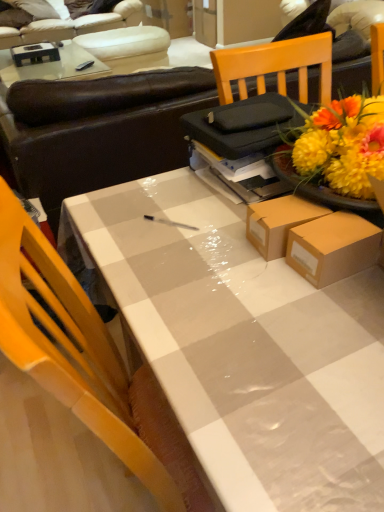
Question: Are white leather armchair at upper left and brown leather couch at upper center, which ranks as the first studio couch in front-to-back order, located far from each other?

Choices:
 (A) yes
 (B) no

Answer: (A)

Question: From the image's perspective, would you say white leather armchair at upper left is positioned over brown leather couch at upper center, arranged as the first studio couch when ordered from the bottom?

Choices:
 (A) no
 (B) yes

Answer: (B)

Question: From a real-world perspective, is white leather armchair at upper left beneath brown leather couch at upper center, arranged as the first studio couch when ordered from the bottom?

Choices:
 (A) yes
 (B) no

Answer: (A)

Question: Can you confirm if white leather armchair at upper left is taller than brown leather couch at upper center, the second studio couch when ordered from back to front?

Choices:
 (A) no
 (B) yes

Answer: (A)

Question: Is the depth of white leather armchair at upper left greater than that of brown leather couch at upper center, arranged as the first studio couch when ordered from the bottom?

Choices:
 (A) yes
 (B) no

Answer: (A)

Question: Is white leather armchair at upper left outside of brown leather couch at upper center, the second studio couch viewed from the top?

Choices:
 (A) no
 (B) yes

Answer: (B)

Question: Is white leather couch at upper left, which ranks as the first studio couch in top-to-bottom order, in front of brown leather couch at upper center, arranged as the first studio couch when ordered from the bottom?

Choices:
 (A) no
 (B) yes

Answer: (A)

Question: Can you confirm if white leather couch at upper left, the second studio couch positioned from the bottom, is thinner than brown leather couch at upper center, the second studio couch when ordered from back to front?

Choices:
 (A) no
 (B) yes

Answer: (A)

Question: Is the depth of white leather couch at upper left, which ranks as the first studio couch in top-to-bottom order, greater than that of brown leather couch at upper center, the second studio couch when ordered from back to front?

Choices:
 (A) no
 (B) yes

Answer: (B)

Question: Considering the relative positions of white leather couch at upper left, the second studio couch positioned from the bottom, and brown leather couch at upper center, which ranks as the first studio couch in front-to-back order, in the image provided, is white leather couch at upper left, the second studio couch positioned from the bottom, to the left of brown leather couch at upper center, which ranks as the first studio couch in front-to-back order, from the viewer's perspective?

Choices:
 (A) no
 (B) yes

Answer: (B)

Question: Does white leather couch at upper left, acting as the second studio couch starting from the front, have a lesser height compared to brown leather couch at upper center, which ranks as the first studio couch in front-to-back order?

Choices:
 (A) yes
 (B) no

Answer: (A)

Question: From the image's perspective, would you say white leather couch at upper left, acting as the second studio couch starting from the front, is positioned over brown leather couch at upper center, which ranks as the first studio couch in front-to-back order?

Choices:
 (A) yes
 (B) no

Answer: (A)

Question: Does white leather couch at upper left, which ranks as the first studio couch in top-to-bottom order, have a greater width compared to white glossy table at center?

Choices:
 (A) no
 (B) yes

Answer: (B)